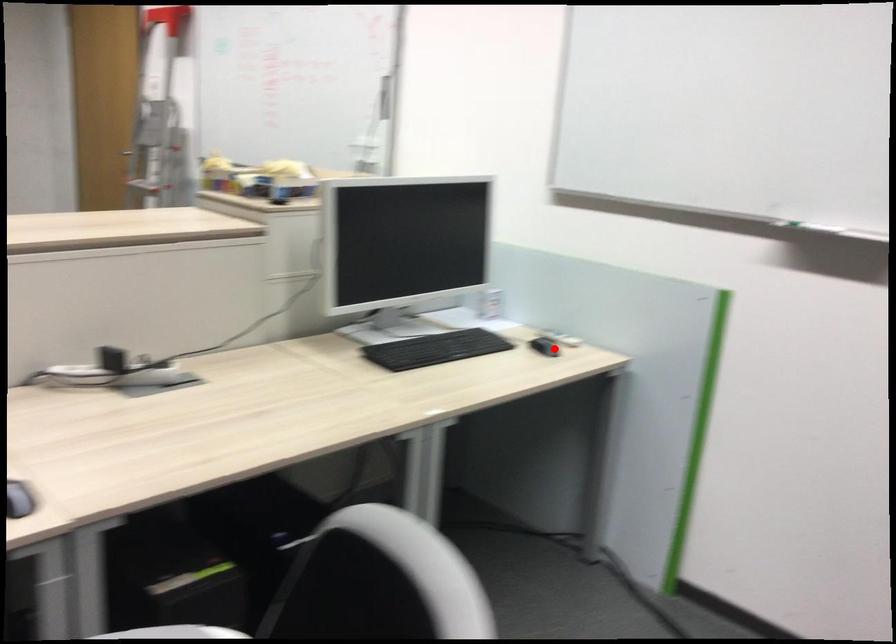
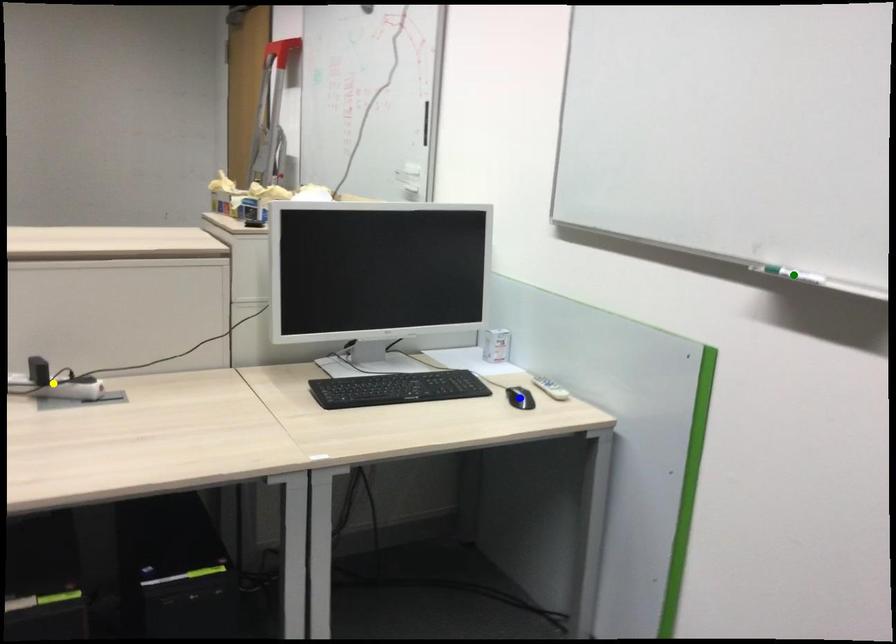
Question: I am providing you with two images of the same scene from different viewpoints. A red point is marked on the first image. You are given multiple points on the second image. Can you choose the point in image 2 that corresponds to the point in image 1?

Choices:
 (A) green point
 (B) blue point
 (C) yellow point

Answer: (B)